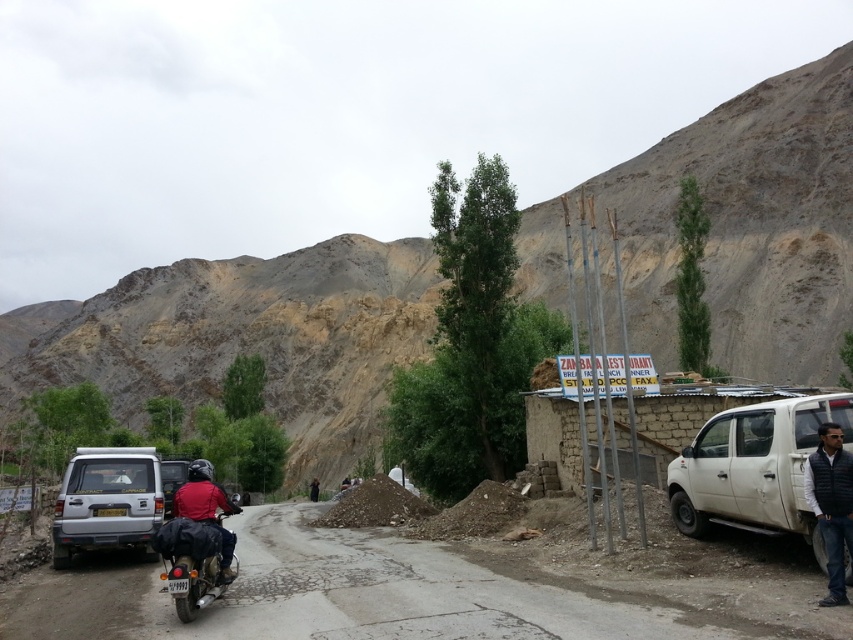
Question: Which point is closer to the camera?

Choices:
 (A) dirt road at center
 (B) red matte jacket at center
 (C) white matte truck at right
 (D) silver metallic minivan at center-left

Answer: (A)

Question: Can you confirm if dirt road at center is positioned to the left of white matte truck at right?

Choices:
 (A) yes
 (B) no

Answer: (A)

Question: Which point appears closest to the camera in this image?

Choices:
 (A) (825, 268)
 (B) (699, 524)
 (C) (311, 554)

Answer: (B)

Question: Is brown rocky hillside at upper center bigger than red matte jacket at center?

Choices:
 (A) no
 (B) yes

Answer: (B)

Question: Where is dirt road at center located in relation to red matte jacket at center in the image?

Choices:
 (A) below
 (B) above

Answer: (A)

Question: Which object is positioned farthest from the white matte truck at right?

Choices:
 (A) silver metallic minivan at center-left
 (B) red matte jacket at center

Answer: (A)